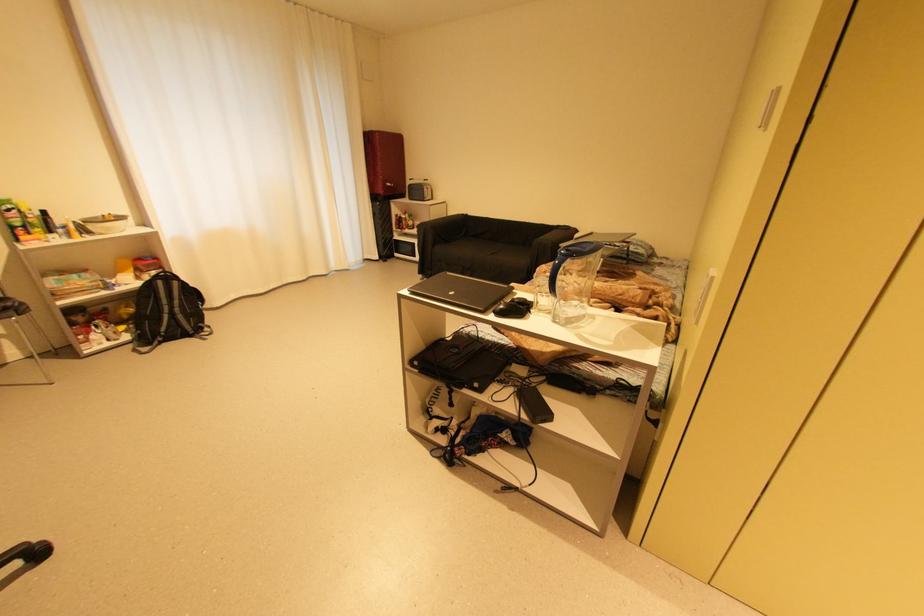
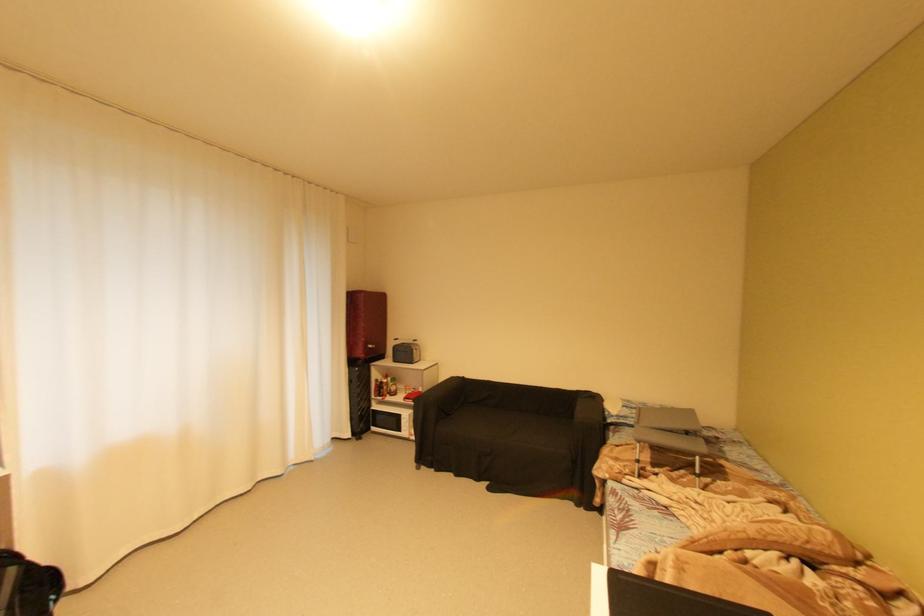
The images are taken continuously from a first-person perspective. In which direction are you moving?

The movement direction of the cameraman is left, forward.